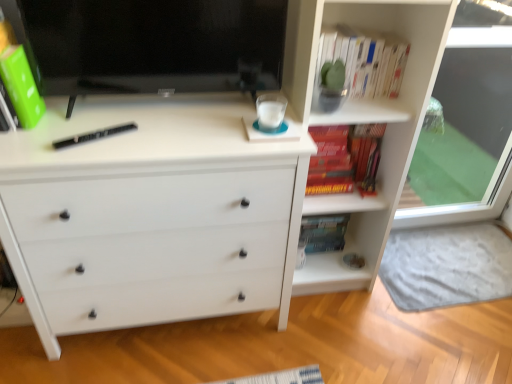
The height and width of the screenshot is (384, 512). I want to click on free space between black hardback book at center and matte black monitor at upper left, so click(135, 127).